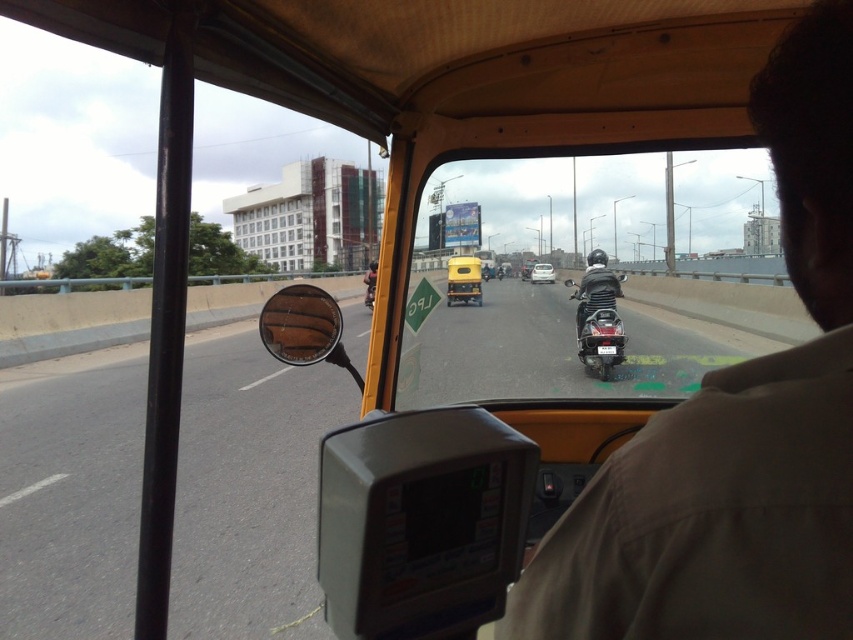
Question: Is light brown leather jacket at upper right above yellow matte bus at center?

Choices:
 (A) no
 (B) yes

Answer: (A)

Question: Is black rubber view mirror at left above yellow matte bus at center?

Choices:
 (A) yes
 (B) no

Answer: (B)

Question: Does matte black motorcycle at center appear over yellow matte bus at center?

Choices:
 (A) yes
 (B) no

Answer: (B)

Question: Which object is positioned closest to the metallic silver car at center?

Choices:
 (A) black rubber view mirror at left
 (B) matte black motorcycle at center
 (C) transparent glass windshield at center
 (D) yellow matte bus at center

Answer: (D)

Question: Which is nearer to the black rubber view mirror at left?

Choices:
 (A) yellow matte bus at center
 (B) metallic silver car at center
 (C) transparent glass windshield at center

Answer: (A)

Question: Which point is closer to the camera taking this photo?

Choices:
 (A) (482, 168)
 (B) (543, 269)
 (C) (477, 273)

Answer: (A)